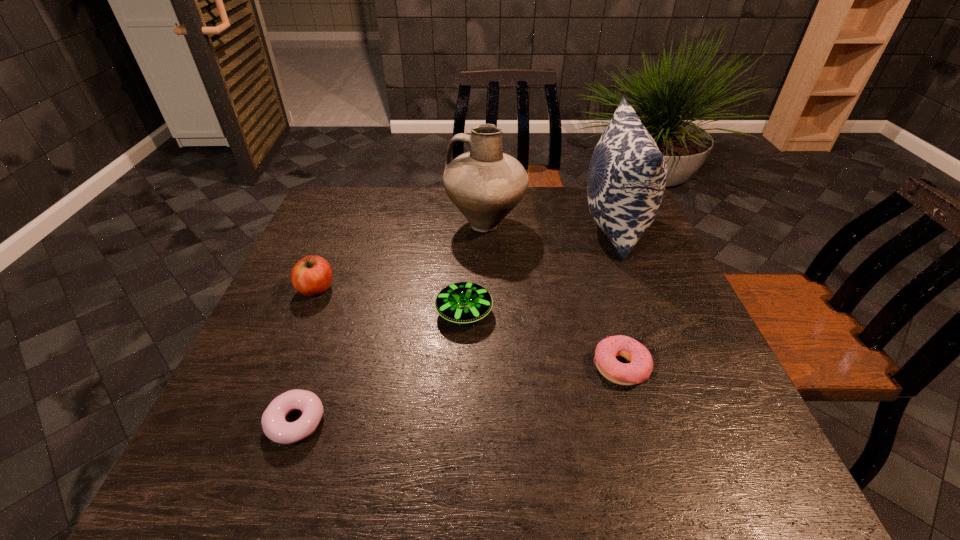
Locate an element on the screen. The width and height of the screenshot is (960, 540). free space at the right edge of the desktop is located at coordinates (x=628, y=280).

Locate an element on the screen. vacant space at the far left corner is located at coordinates (335, 223).

This screenshot has height=540, width=960. In order to click on free space between the fourth shortest object and the saucer in this screenshot , I will do `click(390, 301)`.

Locate an element on the screen. This screenshot has width=960, height=540. empty location between the pitcher and the fourth shortest object is located at coordinates (401, 256).

This screenshot has height=540, width=960. Find the location of `free space between the pitcher and the cushion`. free space between the pitcher and the cushion is located at coordinates (549, 225).

Find the location of a particular element. The width and height of the screenshot is (960, 540). free space between the pitcher and the cushion is located at coordinates (549, 225).

This screenshot has width=960, height=540. I want to click on vacant region between the nearest object and the farther doughnut, so click(x=458, y=395).

At what (x,y) coordinates should I click in order to perform the action: click on free space that is in between the third shortest object and the second nearest object. Please return your answer as a coordinate pair (x, y). The image size is (960, 540). Looking at the image, I should click on (542, 340).

Locate an element on the screen. Image resolution: width=960 pixels, height=540 pixels. empty location between the third shortest object and the cushion is located at coordinates (539, 269).

Locate an element on the screen. blank region between the pitcher and the right doughnut is located at coordinates (553, 295).